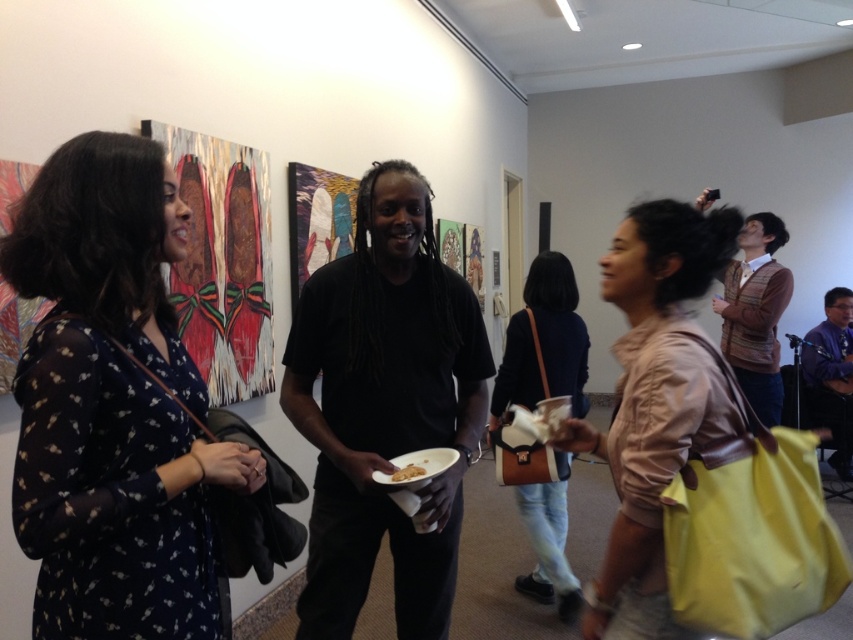
Question: Which of the following is the closest to the observer?

Choices:
 (A) coord(392,474)
 (B) coord(97,376)

Answer: (B)

Question: Is black matte shirt at center above brown sweater at upper right?

Choices:
 (A) yes
 (B) no

Answer: (B)

Question: Which object is positioned closest to the brown sweater at upper right?

Choices:
 (A) leather brown bag at center
 (B) dark blue floral dress at left
 (C) dark blue shirt at center
 (D) black matte shirt at center

Answer: (A)

Question: Can you confirm if dark blue floral dress at left is positioned to the right of black matte shirt at center?

Choices:
 (A) yes
 (B) no

Answer: (B)

Question: Does dark blue shirt at center have a greater width compared to yellow matte paper plate at center?

Choices:
 (A) no
 (B) yes

Answer: (B)

Question: Among these points, which one is nearest to the camera?

Choices:
 (A) (438, 310)
 (B) (392, 481)
 (C) (563, 554)

Answer: (B)